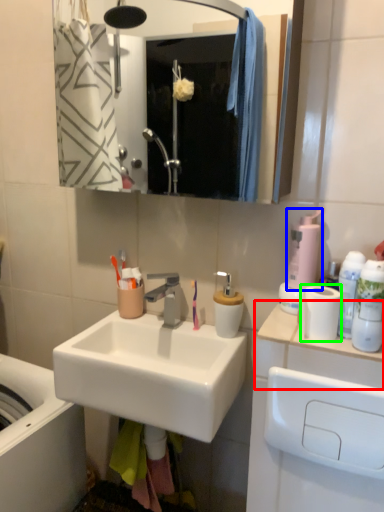
Question: Which is nearer to the counter top (highlighted by a red box)? soap dispenser (highlighted by a blue box) or toilet paper (highlighted by a green box).

Choices:
 (A) soap dispenser
 (B) toilet paper

Answer: (B)